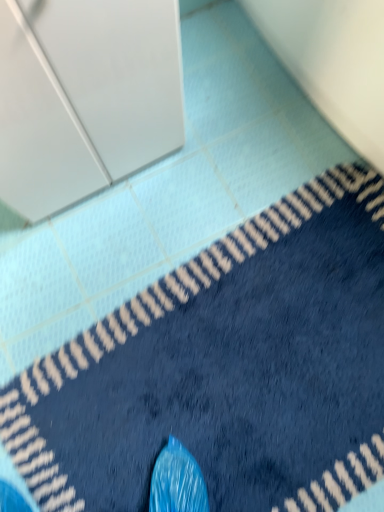
The height and width of the screenshot is (512, 384). I want to click on blue plush bath mat at lower right, so coord(226,369).

What is the approximate height of blue plush bath mat at lower right?

It is 0.79 inches.

Measure the distance between blue plush bath mat at lower right and camera.

33.13 inches.

The image size is (384, 512). Describe the element at coordinates (226, 369) in the screenshot. I see `blue plush bath mat at lower right` at that location.

The width and height of the screenshot is (384, 512). What are the coordinates of `white glossy cabinet at upper left` in the screenshot? It's located at [x=85, y=97].

Describe the element at coordinates (85, 97) in the screenshot. I see `white glossy cabinet at upper left` at that location.

In order to click on blue plush bath mat at lower right in this screenshot , I will do `click(226, 369)`.

Considering the relative positions of white glossy cabinet at upper left and blue plush bath mat at lower right in the image provided, is white glossy cabinet at upper left to the right of blue plush bath mat at lower right from the viewer's perspective?

Incorrect, white glossy cabinet at upper left is not on the right side of blue plush bath mat at lower right.

Does white glossy cabinet at upper left come behind blue plush bath mat at lower right?

No, it is not.

Does point (141, 142) appear closer or farther from the camera than point (365, 485)?

Point (141, 142) is farther from the camera than point (365, 485).

From the image's perspective, which one is positioned lower, white glossy cabinet at upper left or blue plush bath mat at lower right?

blue plush bath mat at lower right appears lower in the image.

From a real-world perspective, is white glossy cabinet at upper left physically located above or below blue plush bath mat at lower right?

white glossy cabinet at upper left is above blue plush bath mat at lower right.

Which object is wider, white glossy cabinet at upper left or blue plush bath mat at lower right?

Wider between the two is blue plush bath mat at lower right.

Considering the sizes of objects white glossy cabinet at upper left and blue plush bath mat at lower right in the image provided, who is shorter, white glossy cabinet at upper left or blue plush bath mat at lower right?

blue plush bath mat at lower right.

Considering the sizes of objects white glossy cabinet at upper left and blue plush bath mat at lower right in the image provided, who is bigger, white glossy cabinet at upper left or blue plush bath mat at lower right?

With larger size is white glossy cabinet at upper left.

Is blue plush bath mat at lower right completely or partially inside white glossy cabinet at upper left?

Definitely not — blue plush bath mat at lower right is not inside white glossy cabinet at upper left.

Are white glossy cabinet at upper left and blue plush bath mat at lower right beside each other?

white glossy cabinet at upper left and blue plush bath mat at lower right are clearly separated.

Is white glossy cabinet at upper left looking in the opposite direction of blue plush bath mat at lower right?

white glossy cabinet at upper left is not turned away from blue plush bath mat at lower right.

The image size is (384, 512). What are the coordinates of `bath mat that is below the white glossy cabinet at upper left (from the image's perspective)` in the screenshot? It's located at (226, 369).

Considering the positions of objects blue plush bath mat at lower right and white glossy cabinet at upper left in the image provided, who is more to the right, blue plush bath mat at lower right or white glossy cabinet at upper left?

blue plush bath mat at lower right is more to the right.

Which object is further away from the camera taking this photo, blue plush bath mat at lower right or white glossy cabinet at upper left?

blue plush bath mat at lower right is further from the camera.

Is point (306, 280) closer or farther from the camera than point (99, 28)?

Point (306, 280) appears to be farther away from the viewer than point (99, 28).

From the image's perspective, which object appears higher, blue plush bath mat at lower right or white glossy cabinet at upper left?

white glossy cabinet at upper left.

From a real-world perspective, who is located higher, blue plush bath mat at lower right or white glossy cabinet at upper left?

white glossy cabinet at upper left is physically above.

Between blue plush bath mat at lower right and white glossy cabinet at upper left, which one has smaller width?

Thinner between the two is white glossy cabinet at upper left.

Who is shorter, blue plush bath mat at lower right or white glossy cabinet at upper left?

Standing shorter between the two is blue plush bath mat at lower right.

Who is smaller, blue plush bath mat at lower right or white glossy cabinet at upper left?

blue plush bath mat at lower right is smaller.

Is white glossy cabinet at upper left completely or partially inside blue plush bath mat at lower right?

Actually, white glossy cabinet at upper left is outside blue plush bath mat at lower right.

Are blue plush bath mat at lower right and white glossy cabinet at upper left making contact?

blue plush bath mat at lower right and white glossy cabinet at upper left are clearly separated.

Is blue plush bath mat at lower right oriented towards white glossy cabinet at upper left?

No, blue plush bath mat at lower right is not facing towards white glossy cabinet at upper left.

Can you tell me how much blue plush bath mat at lower right and white glossy cabinet at upper left differ in facing direction?

84.3 degrees.

Measure the distance between blue plush bath mat at lower right and white glossy cabinet at upper left.

blue plush bath mat at lower right is 16.74 inches from white glossy cabinet at upper left.

Where is `bath mat that appears below the white glossy cabinet at upper left (from a real-world perspective)`? bath mat that appears below the white glossy cabinet at upper left (from a real-world perspective) is located at coordinates (226, 369).

Identify the location of screen door above the blue plush bath mat at lower right (from a real-world perspective). The image size is (384, 512). (85, 97).

This screenshot has width=384, height=512. I want to click on screen door that appears on the left of blue plush bath mat at lower right, so click(x=85, y=97).